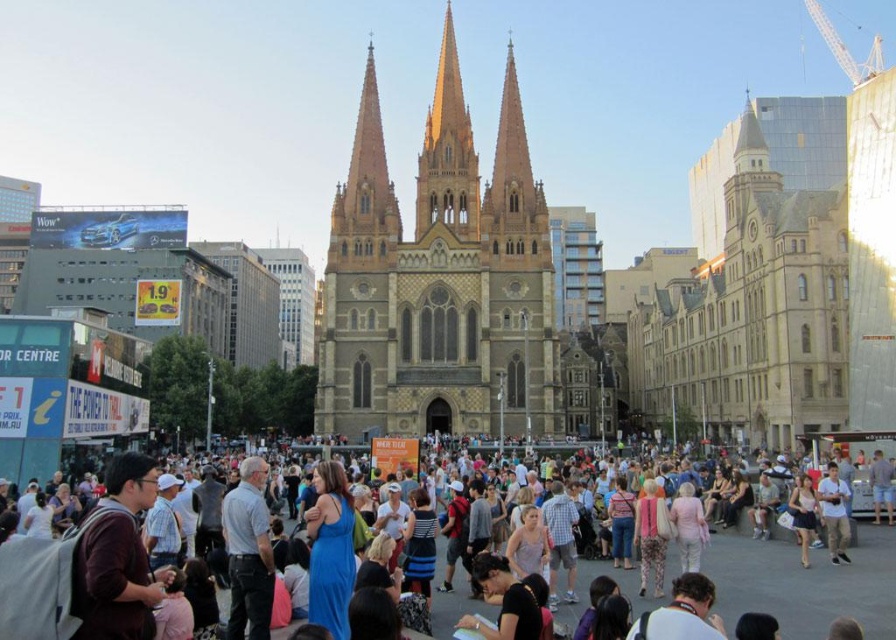
Question: Which object is farther from the camera taking this photo?

Choices:
 (A) brown stone cathedral at center
 (B) multicolored casual attire at center

Answer: (A)

Question: Can you confirm if brown stone cathedral at center is thinner than multicolored casual attire at center?

Choices:
 (A) yes
 (B) no

Answer: (A)

Question: Which of the following is the farthest from the observer?

Choices:
 (A) brown stone cathedral at center
 (B) light blue fabric shirt at center
 (C) multicolored casual attire at center

Answer: (A)

Question: Does brown stone cathedral at center lie behind light blue fabric shirt at center?

Choices:
 (A) yes
 (B) no

Answer: (A)

Question: Does brown stone cathedral at center have a greater width compared to light blue fabric shirt at center?

Choices:
 (A) no
 (B) yes

Answer: (B)

Question: Which point appears closest to the camera in this image?

Choices:
 (A) (862, 524)
 (B) (429, 225)
 (C) (824, 508)

Answer: (C)